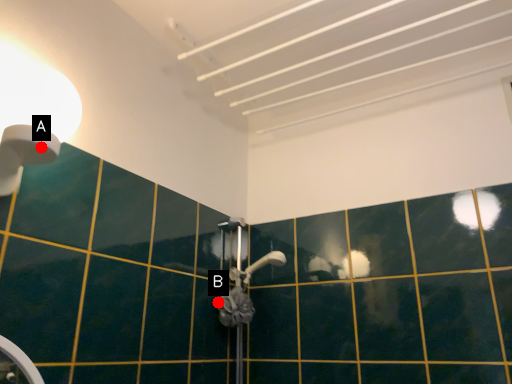
Question: Two points are circled on the image, labeled by A and B beside each circle. Which point is closer to the camera?

Choices:
 (A) A is closer
 (B) B is closer

Answer: (A)